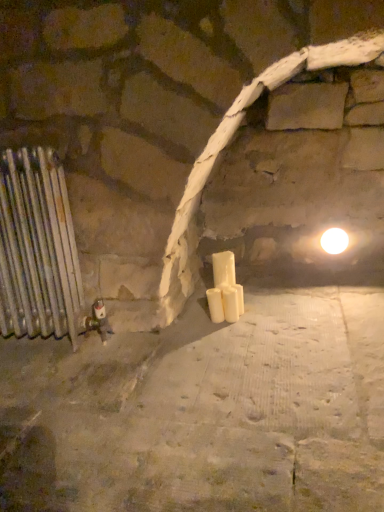
Describe the element at coordinates (334, 241) in the screenshot. The height and width of the screenshot is (512, 384). I see `white glossy light bulb at upper right` at that location.

In order to face silver metallic radiator at left, should I rotate leftwards or rightwards?

Rotate your view left by about 20.781°.

At what (x,y) coordinates should I click in order to perform the action: click on white glossy light bulb at upper right. Please return your answer as a coordinate pair (x, y). The image size is (384, 512). Looking at the image, I should click on (334, 241).

Which is correct: silver metallic radiator at left is inside white matte candle at center, placed as the 2th candle when sorted from left to right, or outside of it?

silver metallic radiator at left is outside white matte candle at center, placed as the 2th candle when sorted from left to right.

Considering the relative sizes of silver metallic radiator at left and white matte candle at center, which ranks as the first candle in right-to-left order, in the image provided, is silver metallic radiator at left smaller than white matte candle at center, which ranks as the first candle in right-to-left order,?

No, silver metallic radiator at left is not smaller than white matte candle at center, which ranks as the first candle in right-to-left order.

How many degrees apart are the facing directions of silver metallic radiator at left and white matte candle at center, placed as the 2th candle when sorted from left to right?

The facing directions of silver metallic radiator at left and white matte candle at center, placed as the 2th candle when sorted from left to right, are 4.82 degrees apart.

In the image, is white glossy light bulb at upper right positioned in front of or behind white matte candle at center, arranged as the second candle when viewed from the right?

white glossy light bulb at upper right is positioned farther from the viewer than white matte candle at center, arranged as the second candle when viewed from the right.

Is point (332, 228) positioned after point (221, 319)?

Yes.

From the picture: Considering the relative sizes of white glossy light bulb at upper right and white matte candle at center, arranged as the second candle when viewed from the right, in the image provided, is white glossy light bulb at upper right smaller than white matte candle at center, arranged as the second candle when viewed from the right,?

No.

From the image's perspective, count 2nd candles downward from the white glossy light bulb at upper right and point to it. Please provide its 2D coordinates.

[(215, 305)]

Based on the photo, considering the relative sizes of silver metallic radiator at left and white glossy light bulb at upper right in the image provided, is silver metallic radiator at left wider than white glossy light bulb at upper right?

Yes.

Could white glossy light bulb at upper right be considered to be inside silver metallic radiator at left?

No, white glossy light bulb at upper right is not a part of silver metallic radiator at left.

Is point (55, 272) farther from camera compared to point (323, 237)?

No, (55, 272) is in front of (323, 237).

Is silver metallic radiator at left facing towards white glossy light bulb at upper right?

No, silver metallic radiator at left does not turn towards white glossy light bulb at upper right.

Can you confirm if white matte candle at center, arranged as the second candle when viewed from the right, is bigger than white glossy light bulb at upper right?

Incorrect, white matte candle at center, arranged as the second candle when viewed from the right, is not larger than white glossy light bulb at upper right.

You are a GUI agent. You are given a task and a screenshot of the screen. Output one action in this format:
    pyautogui.click(x=<x>, y=<y>)
    Task: Click on the 2nd candle directly beneath the white glossy light bulb at upper right (from a real-world perspective)
    
    Given the screenshot: What is the action you would take?
    pyautogui.click(x=215, y=305)

Consider the image. From a real-world perspective, does white matte candle at center, arranged as the second candle when viewed from the right, sit lower than white glossy light bulb at upper right?

Yes, from a real-world perspective, white matte candle at center, arranged as the second candle when viewed from the right, is beneath white glossy light bulb at upper right.

From a real-world perspective, is white glossy light bulb at upper right over white matte candle at center, which ranks as the first candle in right-to-left order?

Yes, from a real-world perspective, white glossy light bulb at upper right is on top of white matte candle at center, which ranks as the first candle in right-to-left order.

Can you confirm if white glossy light bulb at upper right is shorter than white matte candle at center, which ranks as the first candle in right-to-left order?

Yes, white glossy light bulb at upper right is shorter than white matte candle at center, which ranks as the first candle in right-to-left order.

Would you say white glossy light bulb at upper right contains white matte candle at center, which ranks as the first candle in right-to-left order?

That's incorrect, white matte candle at center, which ranks as the first candle in right-to-left order, is not inside white glossy light bulb at upper right.

Looking at this image, between white glossy light bulb at upper right and silver metallic radiator at left, which one has more height?

silver metallic radiator at left.

Is white glossy light bulb at upper right bigger than silver metallic radiator at left?

No, white glossy light bulb at upper right is not bigger than silver metallic radiator at left.

Find the location of `radiator in front of the white glossy light bulb at upper right`. radiator in front of the white glossy light bulb at upper right is located at coordinates (38, 249).

Is white glossy light bulb at upper right closer to camera compared to silver metallic radiator at left?

No, white glossy light bulb at upper right is behind silver metallic radiator at left.

Which object is thinner, white matte candle at center, arranged as the second candle when viewed from the right, or white matte candle at center, placed as the 2th candle when sorted from left to right?

white matte candle at center, arranged as the second candle when viewed from the right.

Does white matte candle at center, arranged as the second candle when viewed from the right, have a lesser height compared to white matte candle at center, placed as the 2th candle when sorted from left to right?

Yes.

Is white matte candle at center, acting as the 1th candle starting from the left, looking in the opposite direction of white matte candle at center, which ranks as the first candle in right-to-left order?

white matte candle at center, acting as the 1th candle starting from the left, is not turned away from white matte candle at center, which ranks as the first candle in right-to-left order.

Where is `radiator lying on the left of white matte candle at center, which ranks as the first candle in right-to-left order`? Image resolution: width=384 pixels, height=512 pixels. radiator lying on the left of white matte candle at center, which ranks as the first candle in right-to-left order is located at coordinates (38, 249).

Identify the location of the 2nd candle below the white glossy light bulb at upper right (from the image's perspective). This screenshot has height=512, width=384. (215, 305).

When comparing their distances from white matte candle at center, which ranks as the first candle in right-to-left order, does white glossy light bulb at upper right or white matte candle at center, arranged as the second candle when viewed from the right, seem closer?

The object closer to white matte candle at center, which ranks as the first candle in right-to-left order, is white matte candle at center, arranged as the second candle when viewed from the right.

Considering their positions, is white glossy light bulb at upper right positioned closer to white matte candle at center, acting as the 1th candle starting from the left, than white matte candle at center, which ranks as the first candle in right-to-left order?

white matte candle at center, which ranks as the first candle in right-to-left order, lies closer to white matte candle at center, acting as the 1th candle starting from the left, than the other object.

Based on their spatial positions, is white matte candle at center, arranged as the second candle when viewed from the right, or white glossy light bulb at upper right closer to white matte candle at center, which ranks as the first candle in right-to-left order?

white matte candle at center, arranged as the second candle when viewed from the right, is closer to white matte candle at center, which ranks as the first candle in right-to-left order.

Considering their positions, is white glossy light bulb at upper right positioned closer to silver metallic radiator at left than white matte candle at center, arranged as the second candle when viewed from the right?

white matte candle at center, arranged as the second candle when viewed from the right, lies closer to silver metallic radiator at left than the other object.

Which object lies nearer to the anchor point white matte candle at center, placed as the 2th candle when sorted from left to right, silver metallic radiator at left or white matte candle at center, arranged as the second candle when viewed from the right?

Based on the image, white matte candle at center, arranged as the second candle when viewed from the right, appears to be nearer to white matte candle at center, placed as the 2th candle when sorted from left to right.

Based on their spatial positions, is white matte candle at center, acting as the 1th candle starting from the left, or silver metallic radiator at left closer to white glossy light bulb at upper right?

Based on the image, white matte candle at center, acting as the 1th candle starting from the left, appears to be nearer to white glossy light bulb at upper right.

From the image, which object appears to be nearer to white matte candle at center, which ranks as the first candle in right-to-left order, silver metallic radiator at left or white glossy light bulb at upper right?

white glossy light bulb at upper right.

From the image, which object appears to be farther from silver metallic radiator at left, white matte candle at center, acting as the 1th candle starting from the left, or white glossy light bulb at upper right?

Among the two, white glossy light bulb at upper right is located further to silver metallic radiator at left.

At what (x,y) coordinates should I click in order to perform the action: click on candle between white matte candle at center, acting as the 1th candle starting from the left, and white glossy light bulb at upper right, in the horizontal direction. Please return your answer as a coordinate pair (x, y). The width and height of the screenshot is (384, 512). Looking at the image, I should click on (230, 303).

This screenshot has width=384, height=512. Identify the location of candle between silver metallic radiator at left and white matte candle at center, placed as the 2th candle when sorted from left to right, from left to right. pyautogui.click(x=215, y=305).